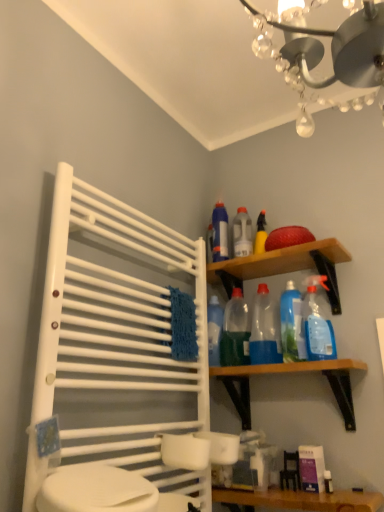
This screenshot has height=512, width=384. Identify the location of vacant space situated above wooden vanity at lower center (from a real-world perspective). (304, 492).